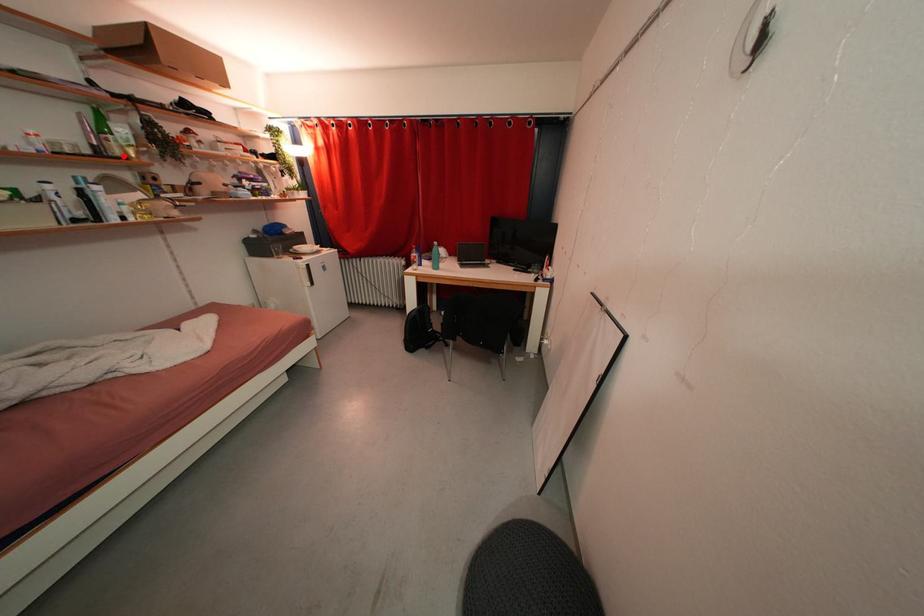
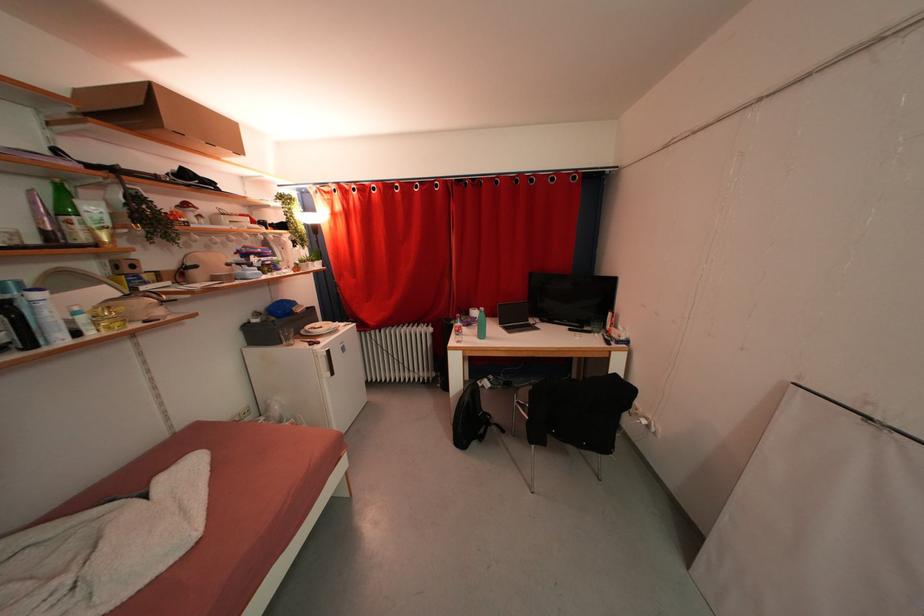
Find the pixel in the second image that matches the highlighted location in the first image.

(89, 241)